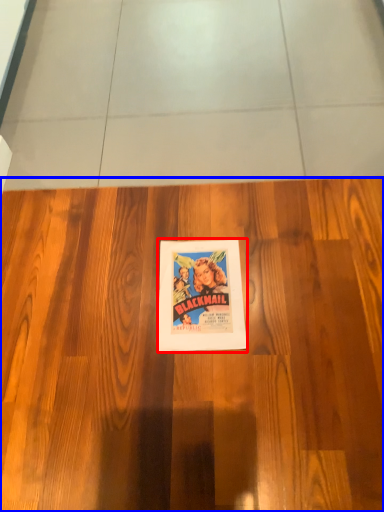
Question: Which object is further to the camera taking this photo, poster (highlighted by a red box) or hardwood (highlighted by a blue box)?

Choices:
 (A) poster
 (B) hardwood

Answer: (A)